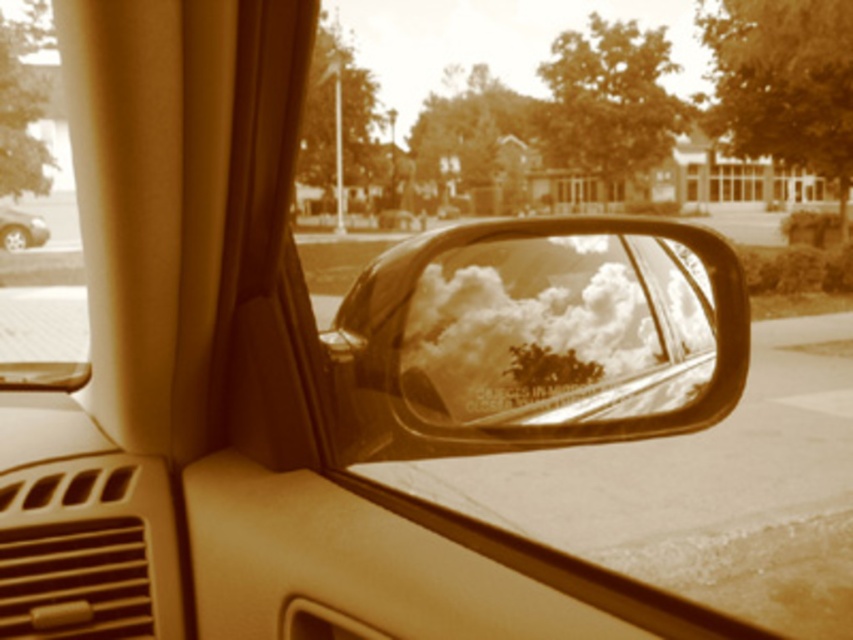
Question: Which point is farther to the camera?

Choices:
 (A) (28, 106)
 (B) (461, 268)
 (C) (161, 516)
 (D) (36, 227)

Answer: (D)

Question: Which object is farther from the camera taking this photo?

Choices:
 (A) transparent glass car window at upper left
 (B) metallic silver car at left
 (C) matte plastic dashboard at lower left
 (D) shiny reflective mirror at center

Answer: (B)

Question: Which point is farther to the camera?

Choices:
 (A) metallic silver car at left
 (B) shiny reflective mirror at center
 (C) matte plastic dashboard at lower left

Answer: (A)

Question: From the image, what is the correct spatial relationship of shiny reflective mirror at center in relation to transparent glass car window at upper left?

Choices:
 (A) above
 (B) below

Answer: (B)

Question: Is shiny reflective mirror at center above transparent glass car window at upper left?

Choices:
 (A) no
 (B) yes

Answer: (A)

Question: Is shiny reflective mirror at center below metallic silver car at left?

Choices:
 (A) no
 (B) yes

Answer: (B)